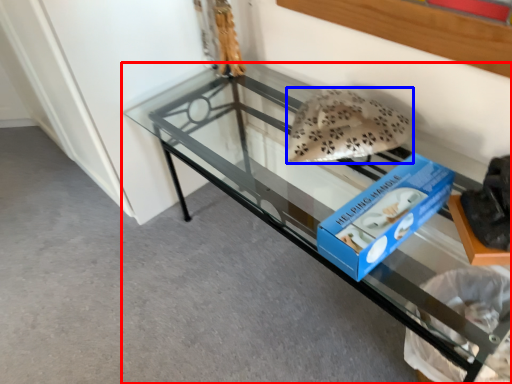
Question: Which of the following is the farthest to the observer, furniture (highlighted by a red box) or stuff (highlighted by a blue box)?

Choices:
 (A) furniture
 (B) stuff

Answer: (B)